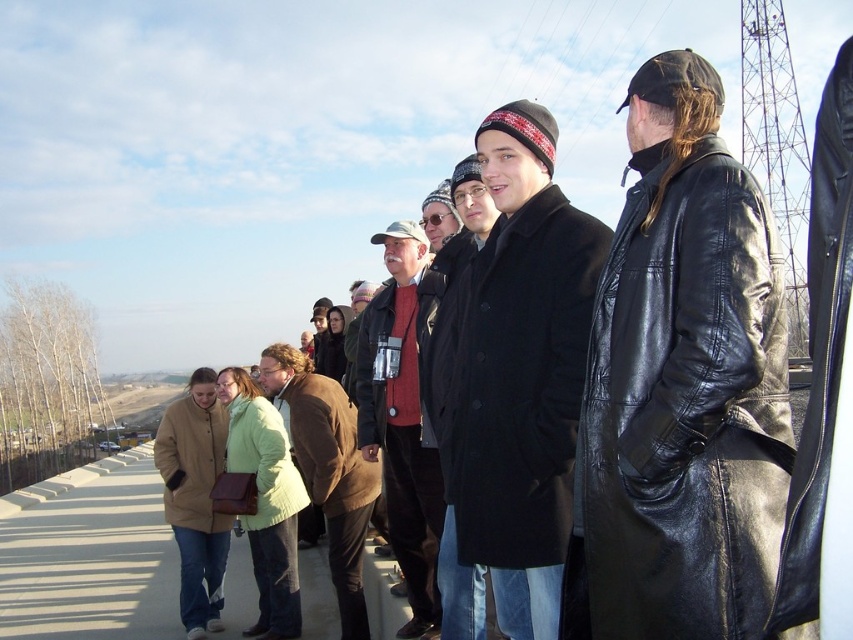
You are a photographer standing on a bridge in winter. You notice two coats in the scene. The beige wool coat at lower left and the black wool coat at center. Which coat is positioned lower in the image?

The beige wool coat at lower left is positioned lower in the image as it is located below the black wool coat at center.

You are standing on a bridge in winter and see the brown leather jacket at lower left. If you want to take a photo of it from a distance of 2 meters, where should you stand relative to the jacket?

Since the brown leather jacket at lower left is at point (328, 468), you should stand 2 meters away from that position to take the photo.

You are a photographer trying to capture a group photo of the people on the bridge. You notice two coats at the lower left corner of your frame, the brown leather jacket at lower left and the beige wool coat at lower left. To ensure both coats are clearly visible in the photo, which coat should you adjust to avoid overlapping with the other?

The brown leather jacket at lower left might be wider than the beige wool coat at lower left, so you should adjust the beige wool coat at lower left to avoid overlapping with the brown leather jacket at lower left.